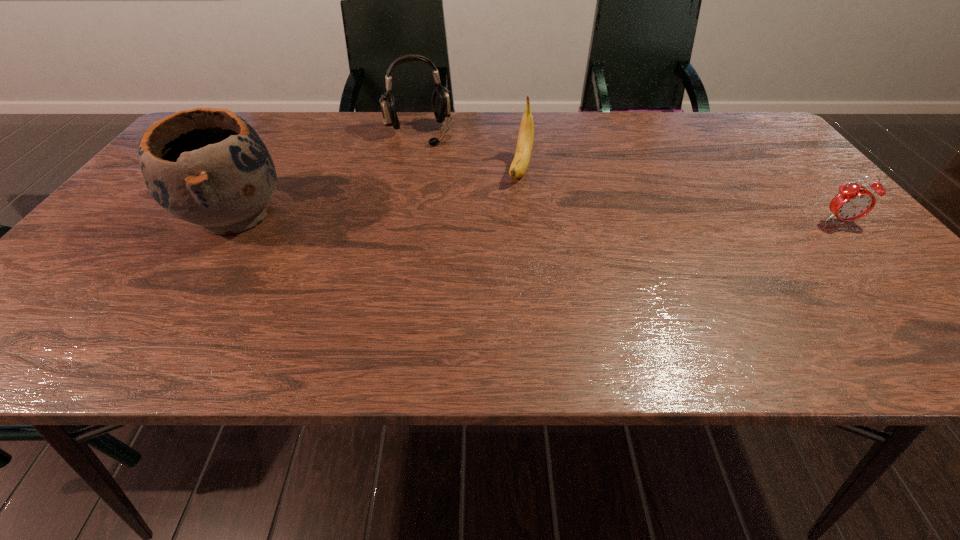
I want to click on pottery, so click(x=207, y=166).

Locate an element on the screen. the rightmost object is located at coordinates (853, 201).

The width and height of the screenshot is (960, 540). I want to click on alarm clock, so click(x=853, y=201).

At what (x,y) coordinates should I click in order to perform the action: click on the third object from left to right. Please return your answer as a coordinate pair (x, y). Looking at the image, I should click on (524, 148).

Find the location of a particular element. Image resolution: width=960 pixels, height=540 pixels. banana is located at coordinates (524, 148).

Find the location of a particular element. the farthest object is located at coordinates (440, 100).

Where is `headset`? This screenshot has height=540, width=960. headset is located at coordinates (440, 100).

Image resolution: width=960 pixels, height=540 pixels. In order to click on free space located 0.100m on the front of the leftmost object in this screenshot , I will do `click(187, 290)`.

Locate an element on the screen. This screenshot has height=540, width=960. vacant space situated 0.220m on the face of the alarm clock is located at coordinates (911, 301).

At what (x,y) coordinates should I click in order to perform the action: click on vacant space located at the start of the peel on the third tallest object. Please return your answer as a coordinate pair (x, y). Looking at the image, I should click on (499, 246).